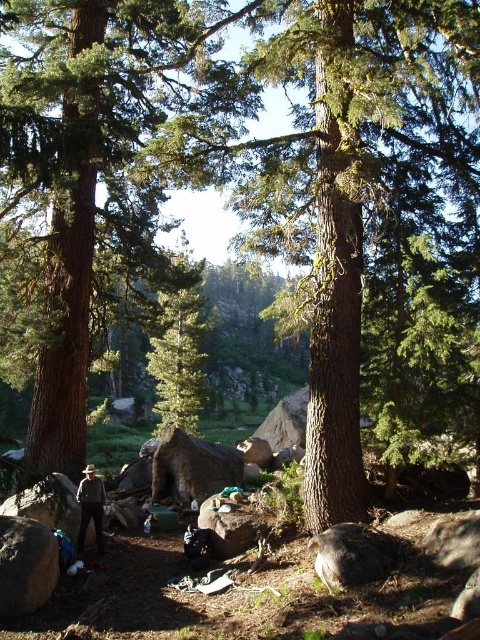
Question: Is green matte tree at center smaller than brown leather hat at lower left?

Choices:
 (A) no
 (B) yes

Answer: (A)

Question: Is green matte tree at center to the left of brown leather hat at lower left from the viewer's perspective?

Choices:
 (A) yes
 (B) no

Answer: (A)

Question: Which object appears closest to the camera in this image?

Choices:
 (A) green matte tree at center
 (B) brown leather hat at lower left

Answer: (B)

Question: Does green matte tree at center appear on the right side of brown leather hat at lower left?

Choices:
 (A) yes
 (B) no

Answer: (B)